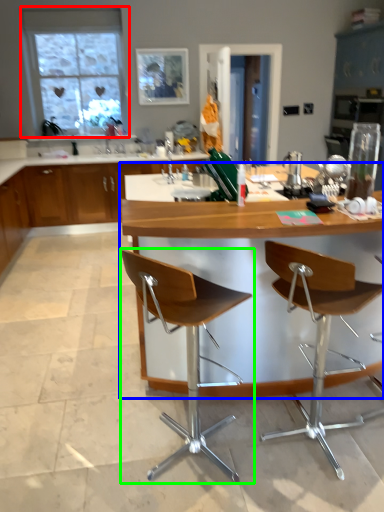
Question: Estimate the real-world distances between objects in this image. Which object is farther from window (highlighted by a red box), table (highlighted by a blue box) or chair (highlighted by a green box)?

Choices:
 (A) table
 (B) chair

Answer: (B)